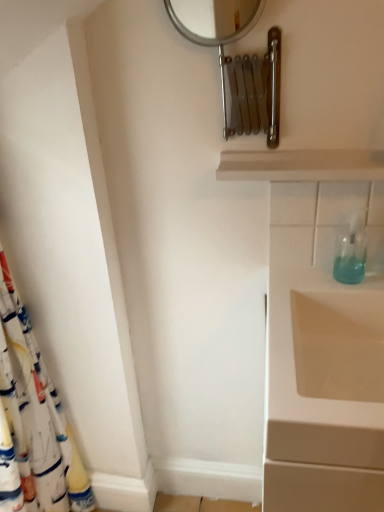
Question: Looking at the image, does white wood shelf at upper center seem bigger or smaller compared to transparent plastic soap dispenser at right?

Choices:
 (A) small
 (B) big

Answer: (B)

Question: Is white wood shelf at upper center taller or shorter than transparent plastic soap dispenser at right?

Choices:
 (A) short
 (B) tall

Answer: (A)

Question: Considering the real-world distances, which object is farthest from the white fabric shower curtain at left?

Choices:
 (A) white wood shelf at upper center
 (B) transparent plastic soap dispenser at right
 (C) silver metallic mirror at upper center

Answer: (B)

Question: Considering the real-world distances, which object is closest to the white wood shelf at upper center?

Choices:
 (A) transparent plastic soap dispenser at right
 (B) white fabric shower curtain at left
 (C) silver metallic mirror at upper center

Answer: (A)